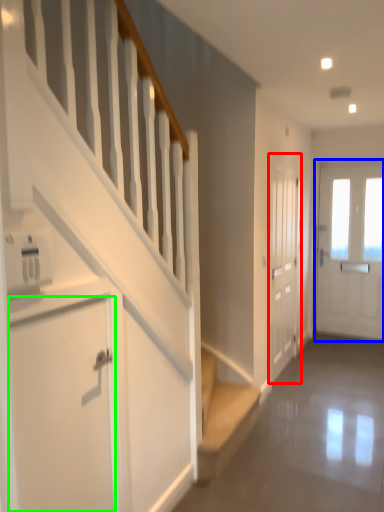
Question: Based on their relative distances, which object is farther from door (highlighted by a red box)? Choose from door (highlighted by a blue box) and door (highlighted by a green box).

Choices:
 (A) door
 (B) door

Answer: (B)